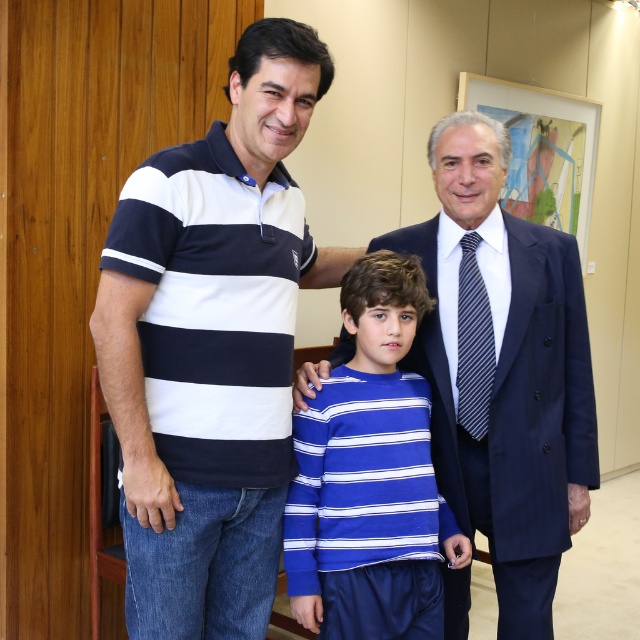
You are trying to identify the clothing items in the image. Which clothing item is positioned to the right of the other between the blue striped shirt at center and the blue striped sweater at center?

The blue striped shirt at center is positioned to the right of the blue striped sweater at center.

You are standing in the image and want to touch the navy blue striped polo shirt at center. If you move straight forward, will you first reach the point at coordinates point (212, 346)?

The point at coordinates point (212, 346) corresponds to the navy blue striped polo shirt at center, so yes, moving straight forward you will first reach the point at coordinates point (212, 346) which is the navy blue striped polo shirt at center.

You are a photographer setting up a photo shoot. You need to position a backdrop that is 1.8 meters in height. The backdrop will be placed behind the navy blue striped polo shirt at center and the blue striped sweater at center. Considering their heights, will the backdrop be sufficient to cover both individuals from head to toe?

The navy blue striped polo shirt at center is much taller than the blue striped sweater at center. Since the backdrop is 1.8 meters tall, it may not be sufficient to cover the taller individual completely, but it should cover the shorter one. However, without knowing their exact heights, we can only assume based on the description provided.